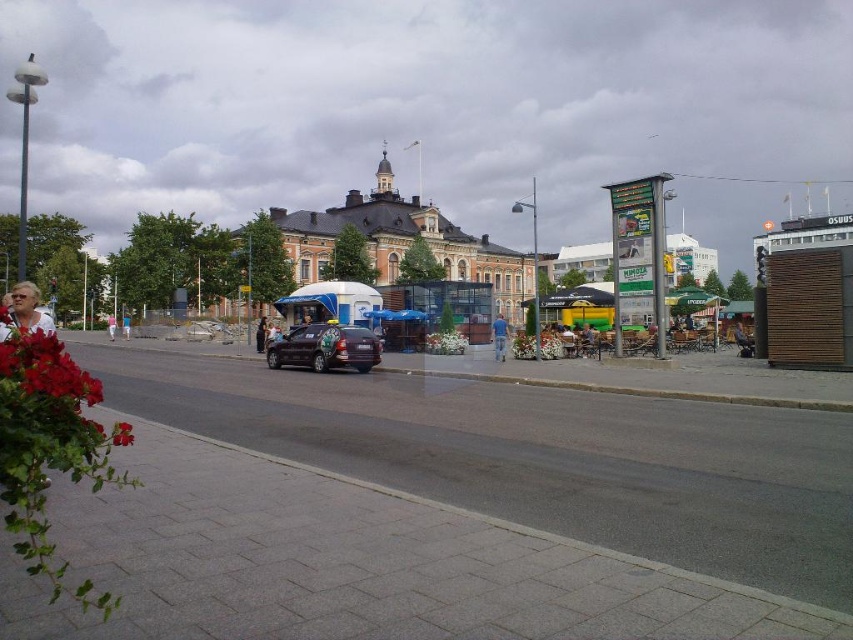
You are a delivery person standing at the point marked by the coordinates point (325, 348). What object are you currently positioned at?

The point (325, 348) corresponds to the shiny black car at center, so you are positioned at the shiny black car at center.

A delivery person needs to walk from the shiny black car at center to the dark brown leather jacket at center. How far will they have to walk?

The shiny black car at center is 21.87 meters away from the dark brown leather jacket at center, so the delivery person will have to walk 21.87 meters.